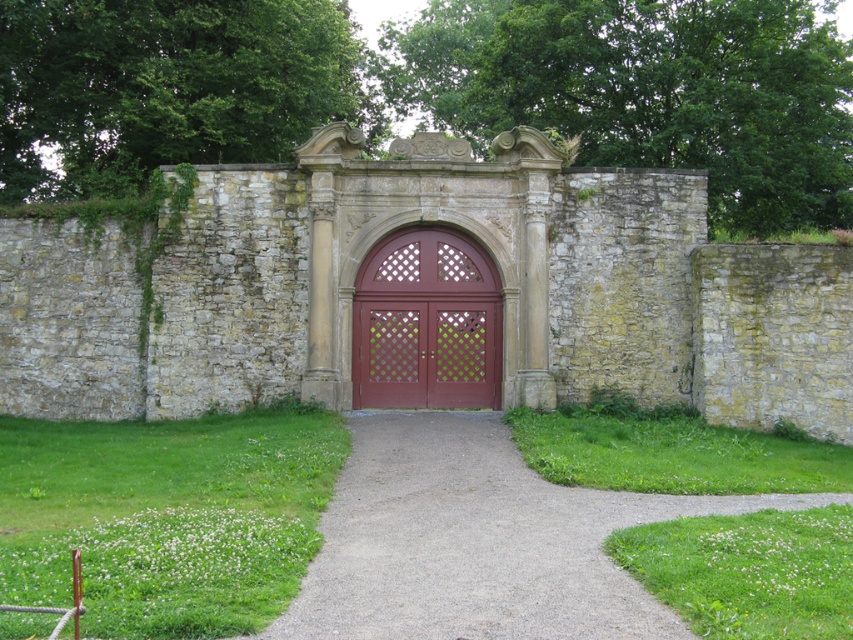
Can you confirm if gravel path at center is bigger than matte wood door at center?

Correct, gravel path at center is larger in size than matte wood door at center.

Does gravel path at center appear on the right side of matte wood door at center?

Correct, you'll find gravel path at center to the right of matte wood door at center.

Is point (798, 499) farther from viewer compared to point (387, 403)?

No, it is in front of (387, 403).

The height and width of the screenshot is (640, 853). What are the coordinates of `gravel path at center` in the screenshot? It's located at (480, 540).